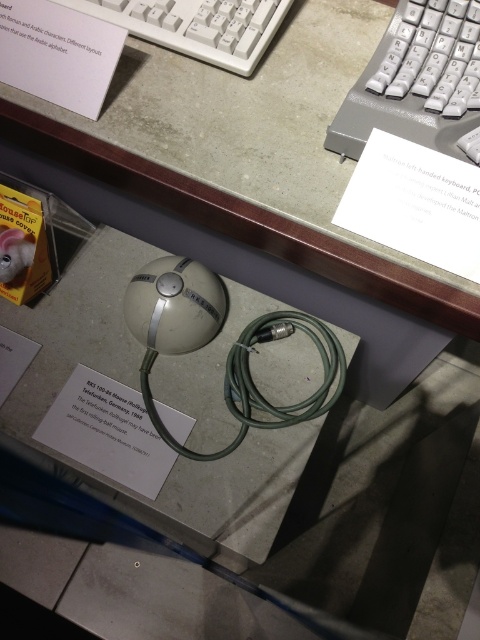
Question: Which point is closer to the camera?

Choices:
 (A) (391, 68)
 (B) (156, 42)

Answer: (A)

Question: Is gray plastic keyboard at upper right below white plastic keyboard at upper center?

Choices:
 (A) yes
 (B) no

Answer: (A)

Question: Which point is farther to the camera?

Choices:
 (A) (220, 314)
 (B) (389, 129)
 (C) (170, 445)

Answer: (A)

Question: Can you confirm if gray plastic keyboard at upper right is smaller than white plastic keyboard at upper center?

Choices:
 (A) no
 (B) yes

Answer: (A)

Question: Which point appears farthest from the camera in this image?

Choices:
 (A) (186, 332)
 (B) (414, 140)

Answer: (A)

Question: From the image, what is the correct spatial relationship of gray plastic keyboard at upper right in relation to green rubber cable at center?

Choices:
 (A) above
 (B) below

Answer: (A)